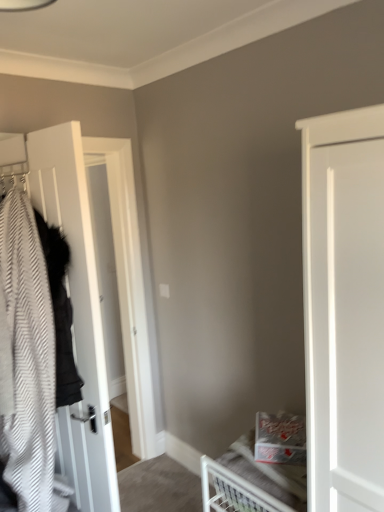
Question: Should I look upward or downward to see white metal bed at lower right?

Choices:
 (A) up
 (B) down

Answer: (B)

Question: Is white wood door at left inside white metal bed at lower right?

Choices:
 (A) no
 (B) yes

Answer: (A)

Question: Is the depth of white metal bed at lower right less than that of white wood door at left?

Choices:
 (A) no
 (B) yes

Answer: (B)

Question: Is white metal bed at lower right positioned with its back to white wood door at left?

Choices:
 (A) no
 (B) yes

Answer: (A)

Question: Is white metal bed at lower right taller than white wood door at left?

Choices:
 (A) no
 (B) yes

Answer: (A)

Question: Considering the relative positions of white metal bed at lower right and white wood door at left in the image provided, is white metal bed at lower right to the right of white wood door at left from the viewer's perspective?

Choices:
 (A) yes
 (B) no

Answer: (A)

Question: Is white metal bed at lower right further to the viewer compared to white wood door at left?

Choices:
 (A) yes
 (B) no

Answer: (B)

Question: Is white wood door at left facing away from white metal bed at lower right?

Choices:
 (A) yes
 (B) no

Answer: (B)

Question: From a real-world perspective, is white wood door at left under white metal bed at lower right?

Choices:
 (A) no
 (B) yes

Answer: (A)

Question: Does white wood door at left have a larger size compared to white metal bed at lower right?

Choices:
 (A) no
 (B) yes

Answer: (B)

Question: Is white wood door at left wider than white metal bed at lower right?

Choices:
 (A) yes
 (B) no

Answer: (B)

Question: Can you confirm if white wood door at left is taller than white metal bed at lower right?

Choices:
 (A) yes
 (B) no

Answer: (A)

Question: Can you confirm if white wood door at left is shorter than white metal bed at lower right?

Choices:
 (A) no
 (B) yes

Answer: (A)

Question: Based on their sizes in the image, would you say white wood door at left is bigger or smaller than white metal bed at lower right?

Choices:
 (A) big
 (B) small

Answer: (A)